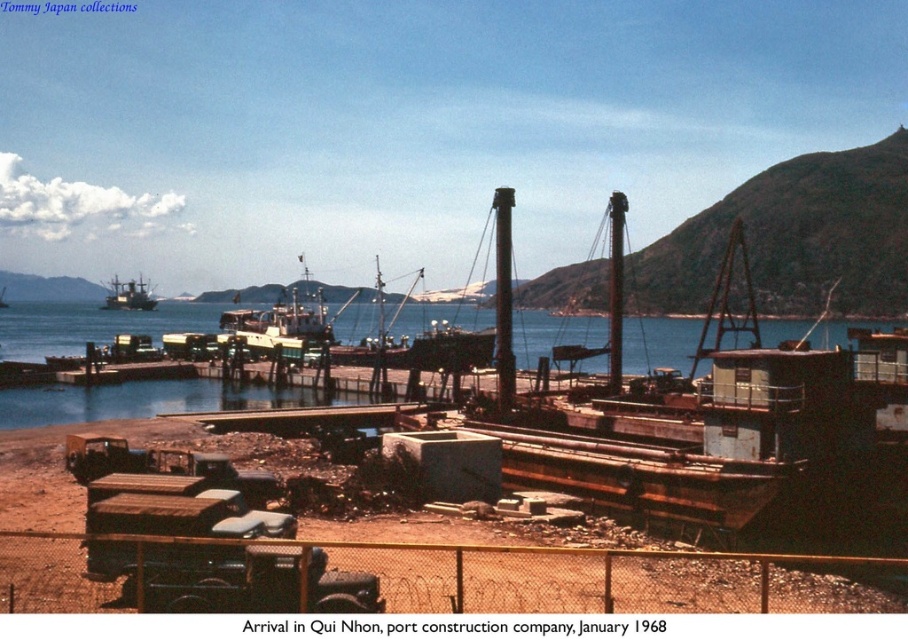
Question: Observing the image, what is the correct spatial positioning of smooth blue water at center in reference to brushed metal boat at upper left?

Choices:
 (A) below
 (B) above

Answer: (A)

Question: Which of the following is the closest to the observer?

Choices:
 (A) brushed metal boat at upper left
 (B) smooth blue water at center

Answer: (B)

Question: Does rusty metal barge at center lie in front of smooth blue water at center?

Choices:
 (A) no
 (B) yes

Answer: (B)

Question: Which point appears farthest from the camera in this image?

Choices:
 (A) (505, 298)
 (B) (119, 308)
 (C) (48, 387)

Answer: (B)

Question: Which point is closer to the camera?

Choices:
 (A) pyautogui.click(x=18, y=397)
 (B) pyautogui.click(x=576, y=406)

Answer: (B)

Question: Where is rusty metal barge at center located in relation to smooth blue water at center in the image?

Choices:
 (A) left
 (B) right

Answer: (B)